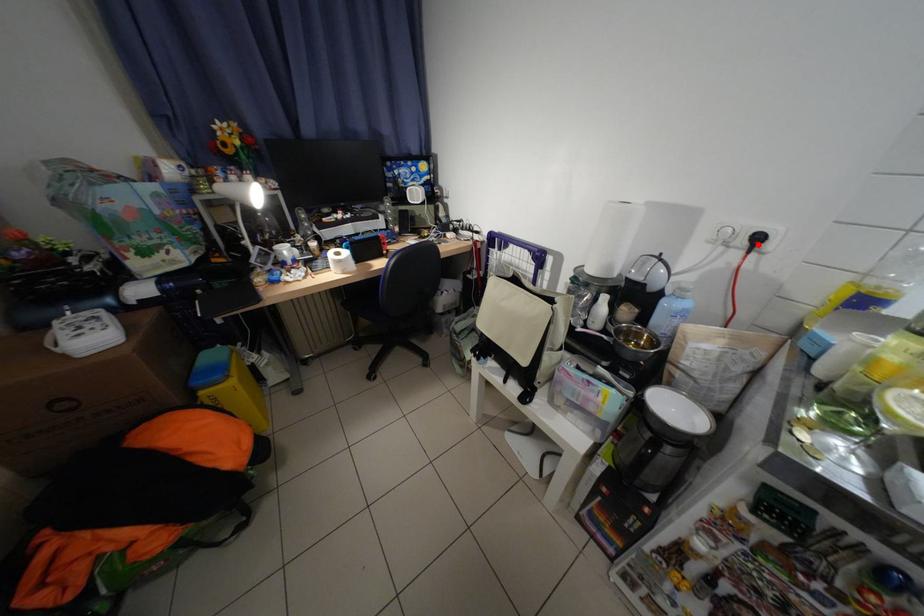
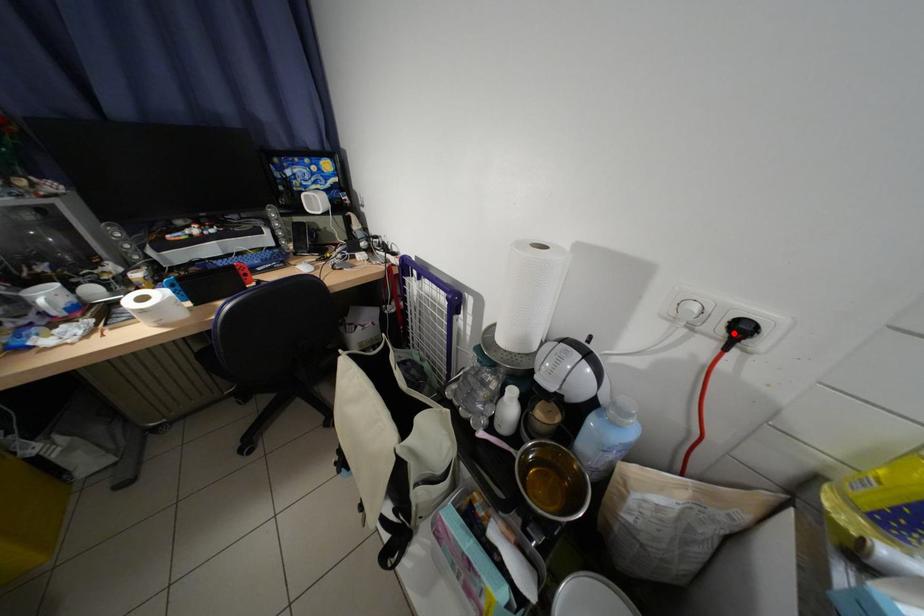
I am providing you with two images of the same scene from different viewpoints. A red point is marked on the first image and another point is marked on the second image. Is the red point in image1 aligned with the point shown in image2?

Yes